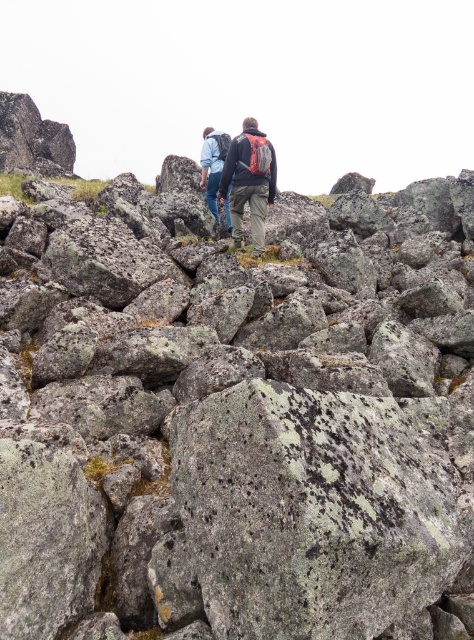
You are a hiker planning to walk between the gray rough rock at center and the blue denim jacket at center. Which direction should you move to avoid the rock?

To avoid the gray rough rock at center, you should move to the left side of the blue denim jacket at center since the rock is on the right side of the jacket.

You are a hiker planning to cross the rugged terrain shown in the image. There is a gray rough rock at center marked by point (237, 417). Can you safely step on this rock without slipping?

The gray rough rock at center is represented by point (237, 417). Since the rock has a rough texture, it provides better traction compared to smooth rocks, making it safer to step on without slipping.